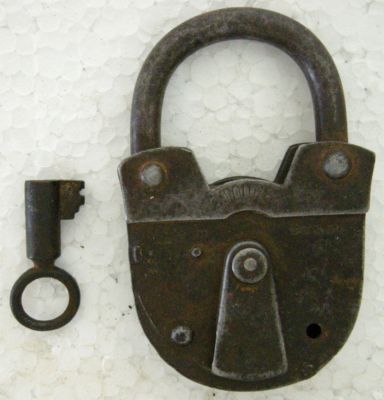
Where is `screws`? This screenshot has width=384, height=400. screws is located at coordinates (159, 181), (340, 167).